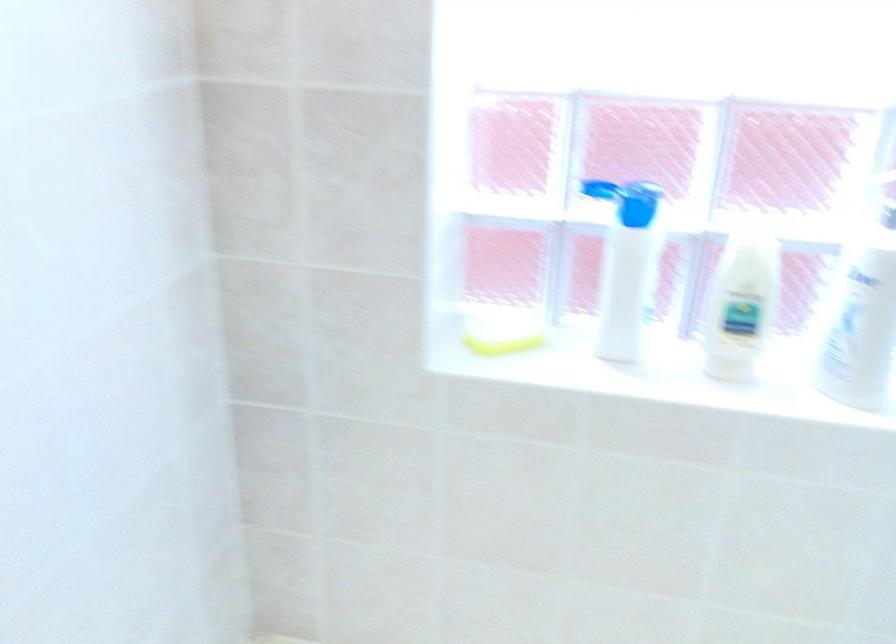
Where would you push the blue bottle cap? Please return your answer as a coordinate pair (x, y).

(636, 203)